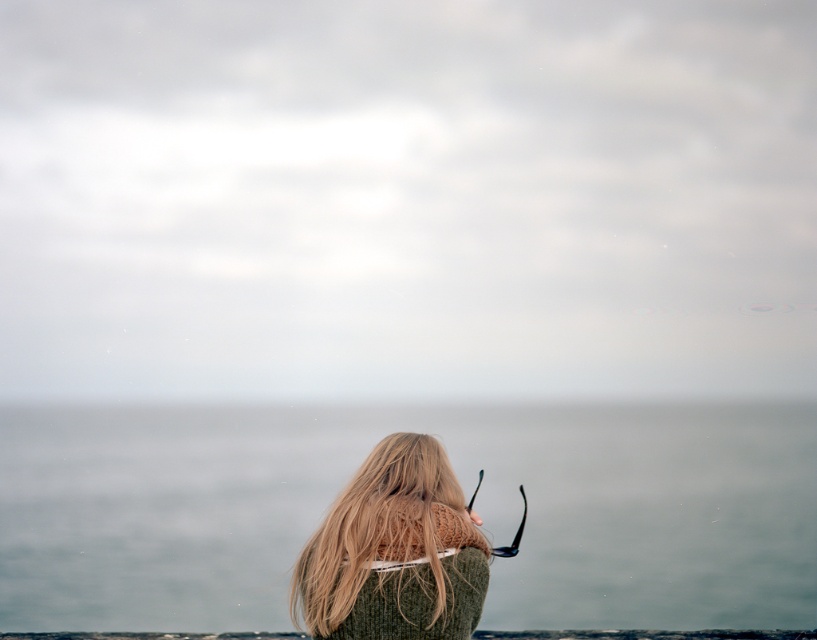
Question: Where is gray matte water at center located in relation to blonde hair at center in the image?

Choices:
 (A) left
 (B) right

Answer: (B)

Question: Where is gray matte water at center located in relation to blonde hair at center in the image?

Choices:
 (A) below
 (B) above

Answer: (A)

Question: Which of the following is the farthest from the observer?

Choices:
 (A) gray matte water at center
 (B) blonde hair at center

Answer: (A)

Question: Which point is closer to the camera?

Choices:
 (A) gray matte water at center
 (B) blonde hair at center

Answer: (B)

Question: Is gray matte water at center to the right of blonde hair at center from the viewer's perspective?

Choices:
 (A) yes
 (B) no

Answer: (A)